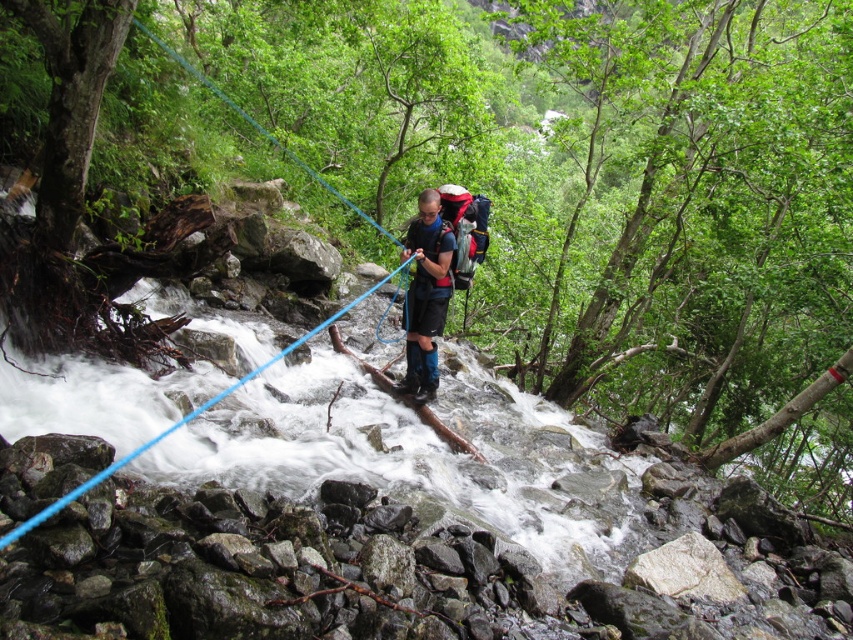
Is matte black backpack at center positioned behind blue synthetic rope at center?

→ Yes, it is behind blue synthetic rope at center.

What do you see at coordinates (425, 296) in the screenshot?
I see `matte black backpack at center` at bounding box center [425, 296].

In order to click on matte black backpack at center in this screenshot , I will do `click(425, 296)`.